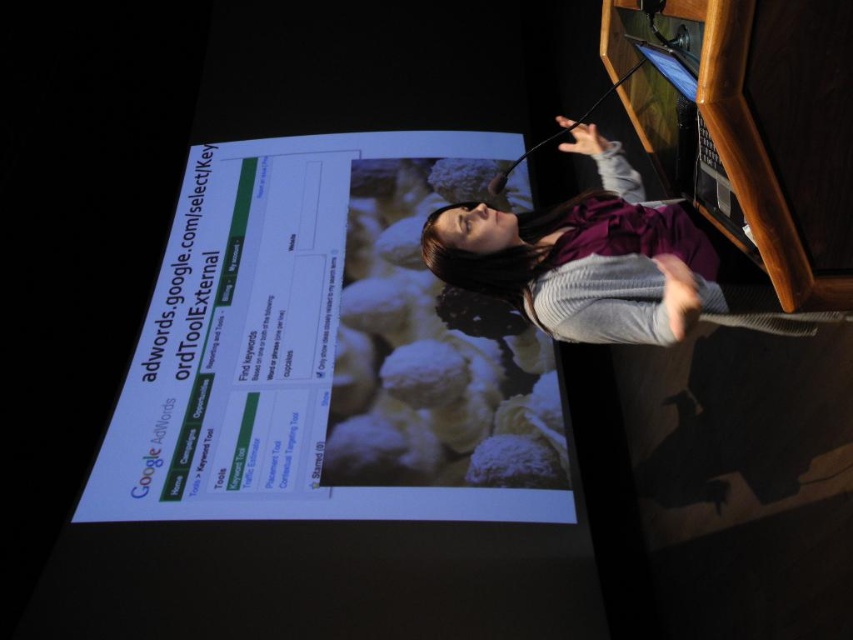
Based on the photo, is the position of white glossy projector screen at center more distant than that of purple fabric dress at center?

Yes.

Does white glossy projector screen at center appear on the right side of purple fabric dress at center?

Incorrect, white glossy projector screen at center is not on the right side of purple fabric dress at center.

At what (x,y) coordinates should I click in order to perform the action: click on white glossy projector screen at center. Please return your answer as a coordinate pair (x, y). Image resolution: width=853 pixels, height=640 pixels. Looking at the image, I should click on (329, 349).